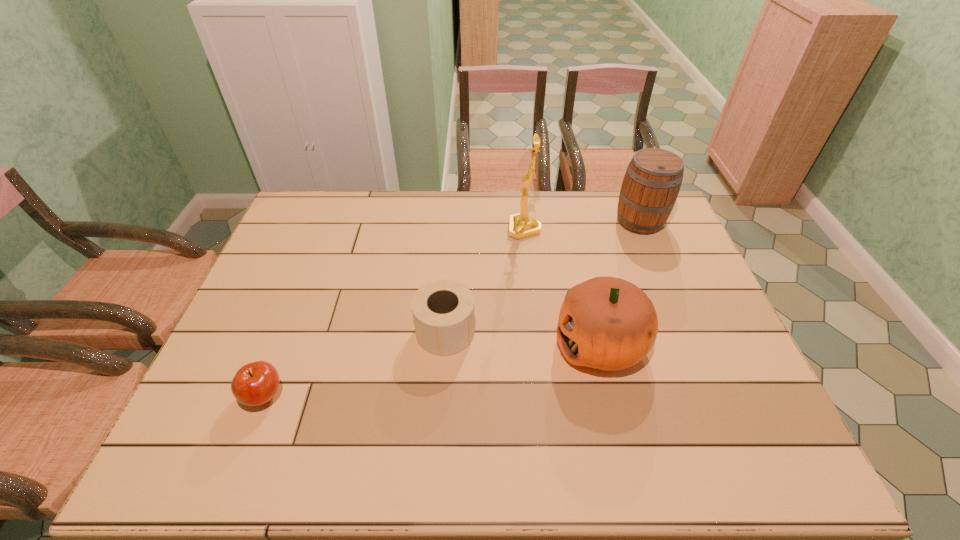
This screenshot has height=540, width=960. I want to click on object that is at the right edge, so click(x=650, y=187).

Identify the location of object at the far right corner. The width and height of the screenshot is (960, 540). (650, 187).

You are a GUI agent. You are given a task and a screenshot of the screen. Output one action in this format:
    pyautogui.click(x=<x>, y=<y>)
    Task: Click on the vacant space at the far edge of the desktop
    This screenshot has height=540, width=960.
    Given the screenshot: What is the action you would take?
    pyautogui.click(x=465, y=230)

You are a GUI agent. You are given a task and a screenshot of the screen. Output one action in this format:
    pyautogui.click(x=<x>, y=<y>)
    Task: Click on the vacant area at the near edge
    Image resolution: width=960 pixels, height=540 pixels.
    Given the screenshot: What is the action you would take?
    pyautogui.click(x=585, y=455)

Locate an element on the screen. This screenshot has height=540, width=960. free spot at the left edge of the desktop is located at coordinates (282, 339).

Locate an element on the screen. This screenshot has width=960, height=540. free location at the right edge of the desktop is located at coordinates (724, 427).

Image resolution: width=960 pixels, height=540 pixels. What are the coordinates of `vacant area that lies between the toilet tissue and the award` in the screenshot? It's located at (485, 280).

At what (x,y) coordinates should I click in order to perform the action: click on unoccupied position between the award and the shortest object. Please return your answer as a coordinate pair (x, y). The width and height of the screenshot is (960, 540). Looking at the image, I should click on (395, 312).

This screenshot has height=540, width=960. In order to click on free space between the fourth object from right to left and the tallest object in this screenshot , I will do `click(485, 280)`.

You are a GUI agent. You are given a task and a screenshot of the screen. Output one action in this format:
    pyautogui.click(x=<x>, y=<y>)
    Task: Click on the empty space that is in between the apple and the pumpkin
    This screenshot has height=540, width=960.
    Given the screenshot: What is the action you would take?
    pyautogui.click(x=432, y=369)